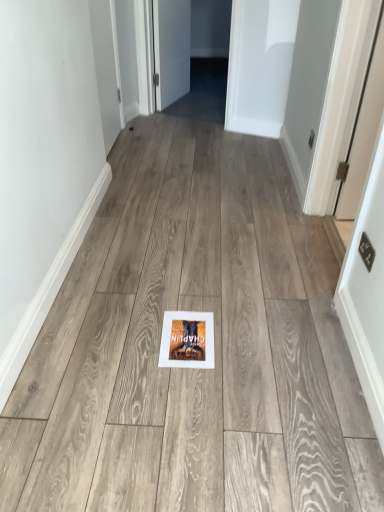
The image size is (384, 512). Identify the location of free spot in front of matte gold postcard at center. [x=185, y=385].